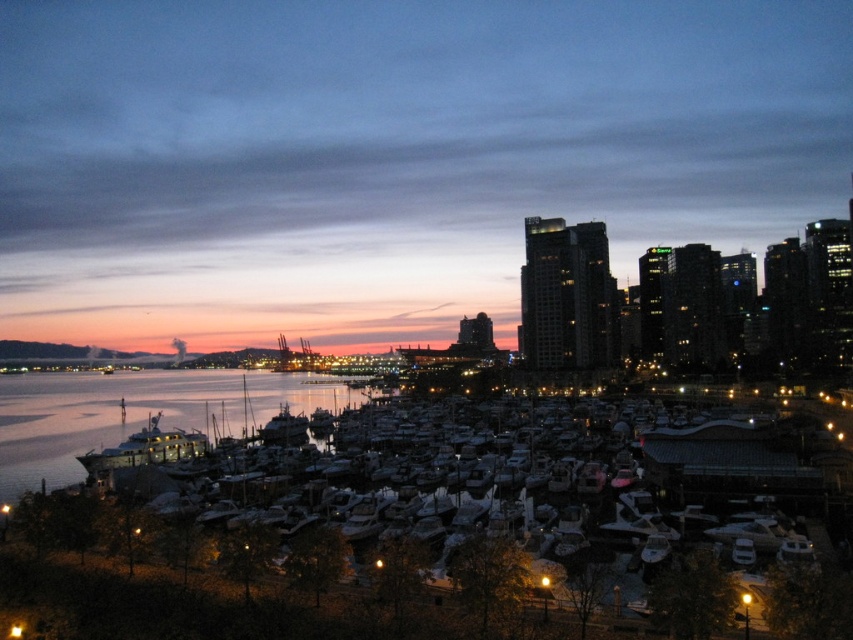
You are a boat captain navigating through the harbor at twilight. You notice two points marked on your radar at coordinates point (79, 380) and point (302, 422). Based on the scene, which point is closer to the horizon?

Point (302, 422) is closer to the horizon because it is in front of point (79, 380), which is behind it according to the description.

You are a photographer wanting to capture the reflection of the shiny silver yacht at center in the glossy water at center. Based on the scene, can you confirm if the yacht is positioned above the water where its reflection would naturally appear?

Yes, the glossy water at center is below the shiny silver yacht at center, so its reflection should appear naturally in the water.

You are standing on the dock and want to place a new decorative boat model on the glossy water at center. However, the shiny metallic boat at center is already occupying that spot. Can you place the model boat there without moving the existing boat?

The glossy water at center is positioned under the shiny metallic boat at center, meaning the boat is already on the water. Therefore, you cannot place the new model boat there without moving the existing shiny metallic boat at center.